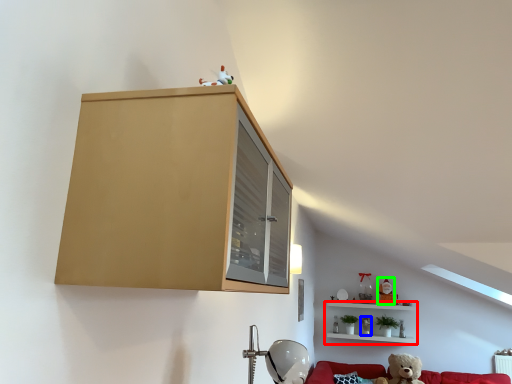
Question: Based on their relative distances, which object is farther from shelf (highlighted by a red box)? Choose from toy (highlighted by a blue box) and toy (highlighted by a green box).

Choices:
 (A) toy
 (B) toy

Answer: (A)